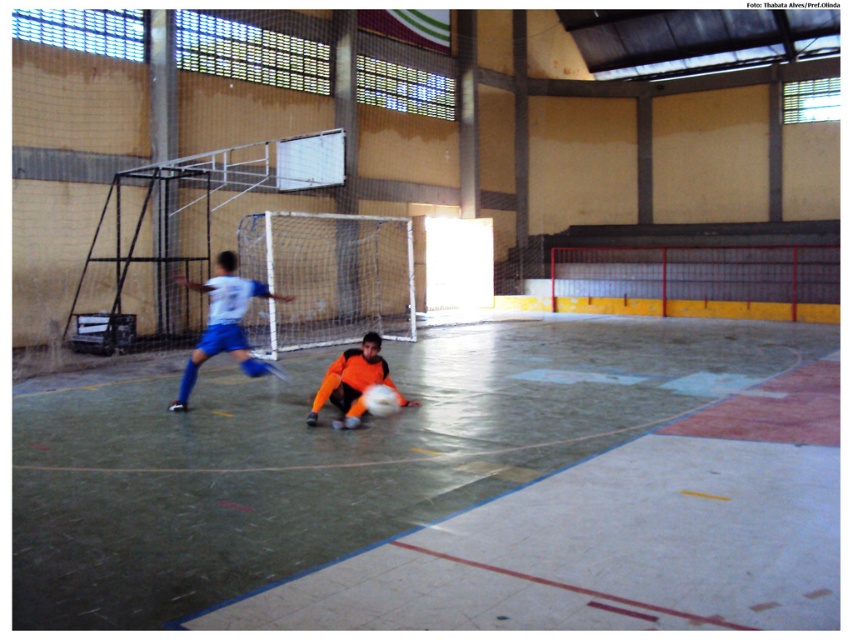
You are a sports analyst watching the indoor soccer match. You notice two players wearing white matte jersey at center and orange jersey at center. Which player has a wider jersey?

The white matte jersey at center has a wider width than the orange jersey at center according to the description.

You are a soccer player trying to score a goal during the match. You notice the white mesh net at center and the white matte jersey at center. Which object is positioned higher in the image?

The white mesh net at center is above the white matte jersey at center, so the white mesh net at center is higher.

You are a soccer referee observing the indoor soccer match. You notice the white mesh net at center and the orange jersey at center. Based on their positions, which object is wider from your viewpoint?

The white mesh net at center is wider than the orange jersey at center from the referee viewpoint.